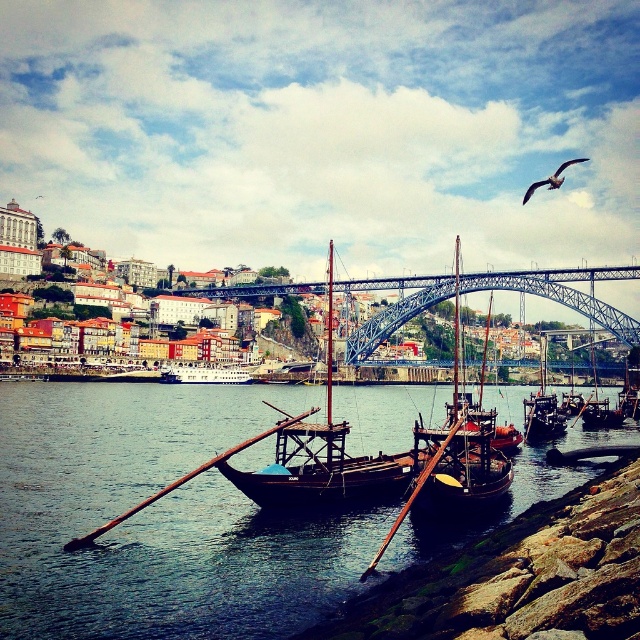
Question: Is blue steel bridge at center bigger than wooden sailboat at center?

Choices:
 (A) no
 (B) yes

Answer: (A)

Question: Considering the real-world distances, which object is farthest from the wooden sailboat at center?

Choices:
 (A) smooth dark water at center
 (B) wooden boat at center

Answer: (A)

Question: Which of these objects is positioned closest to the white glossy boat at center?

Choices:
 (A) wooden sailboat at center
 (B) smooth dark water at center

Answer: (B)

Question: Is smooth dark water at center wider than wooden boat at center?

Choices:
 (A) yes
 (B) no

Answer: (A)

Question: Based on their relative distances, which object is nearer to the wooden boat at center?

Choices:
 (A) wooden sailboat at center
 (B) smooth dark water at center
 (C) blue steel bridge at center
 (D) white glossy boat at center

Answer: (A)

Question: Does smooth dark water at center have a greater width compared to wooden boat at center?

Choices:
 (A) no
 (B) yes

Answer: (B)